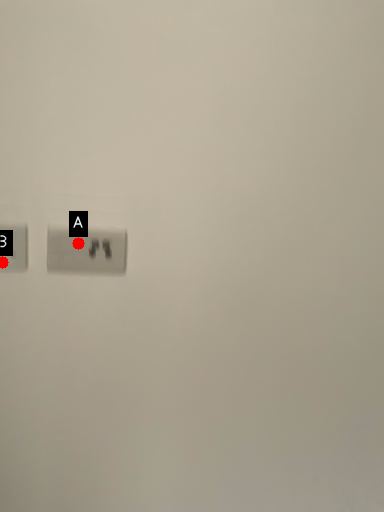
Question: Two points are circled on the image, labeled by A and B beside each circle. Which of the following is the closest to the observer?

Choices:
 (A) A is closer
 (B) B is closer

Answer: (B)